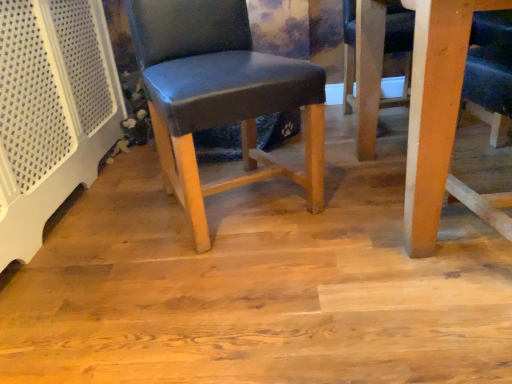
At what (x,y) coordinates should I click in order to perform the action: click on wooden table at lower right. Please return your answer as a coordinate pair (x, y). Looking at the image, I should click on (441, 122).

I want to click on matte blue leather chair at center, so click(220, 96).

Locate an element on the screen. wooden table at lower right is located at coordinates (441, 122).

Which of these two, matte wood floor at center or wooden table at lower right, stands shorter?

With less height is matte wood floor at center.

Locate an element on the screen. table on the right of matte wood floor at center is located at coordinates click(441, 122).

From the image's perspective, between matte wood floor at center and wooden table at lower right, which one is located above?

From the image's view, wooden table at lower right is above.

Considering the relative sizes of matte wood floor at center and wooden table at lower right in the image provided, is matte wood floor at center wider than wooden table at lower right?

Indeed, matte wood floor at center has a greater width compared to wooden table at lower right.

Considering the relative sizes of matte blue leather chair at center and matte wood floor at center in the image provided, is matte blue leather chair at center smaller than matte wood floor at center?

Actually, matte blue leather chair at center might be larger than matte wood floor at center.

Between matte blue leather chair at center and matte wood floor at center, which one appears on the left side from the viewer's perspective?

matte blue leather chair at center.

Is matte blue leather chair at center looking in the opposite direction of matte wood floor at center?

That's not correct — matte blue leather chair at center is not looking away from matte wood floor at center.

Locate an element on the screen. chair located above the matte wood floor at center (from the image's perspective) is located at coordinates (220, 96).

Is wooden table at lower right not within matte blue leather chair at center?

Yes, wooden table at lower right is not within matte blue leather chair at center.

Is wooden table at lower right oriented towards matte blue leather chair at center?

No, wooden table at lower right does not turn towards matte blue leather chair at center.

Which of these two, wooden table at lower right or matte blue leather chair at center, is bigger?

wooden table at lower right is bigger.

Can you confirm if wooden table at lower right is positioned to the left of matte blue leather chair at center?

No.

Can you confirm if wooden table at lower right is shorter than matte wood floor at center?

Incorrect, the height of wooden table at lower right does not fall short of that of matte wood floor at center.

Is point (414, 184) farther from viewer compared to point (435, 339)?

That is True.

Considering the relative sizes of wooden table at lower right and matte wood floor at center in the image provided, is wooden table at lower right wider than matte wood floor at center?

In fact, wooden table at lower right might be narrower than matte wood floor at center.

Is matte wood floor at center located within wooden table at lower right?

No, matte wood floor at center is not surrounded by wooden table at lower right.

Is point (189, 161) in front of point (504, 220)?

No, (189, 161) is further to viewer.

Considering the relative sizes of matte blue leather chair at center and wooden table at lower right in the image provided, is matte blue leather chair at center smaller than wooden table at lower right?

Correct, matte blue leather chair at center occupies less space than wooden table at lower right.

In terms of height, does matte blue leather chair at center look taller or shorter compared to wooden table at lower right?

Clearly, matte blue leather chair at center is taller compared to wooden table at lower right.

In the scene shown: Can wooden table at lower right be found inside matte blue leather chair at center?

Result: No, wooden table at lower right is not inside matte blue leather chair at center.

From their relative heights in the image, would you say matte wood floor at center is taller or shorter than matte blue leather chair at center?

In the image, matte wood floor at center appears to be shorter than matte blue leather chair at center.

Is matte wood floor at center beside matte blue leather chair at center?

No, matte wood floor at center is not with matte blue leather chair at center.

Considering the sizes of objects matte wood floor at center and matte blue leather chair at center in the image provided, who is wider, matte wood floor at center or matte blue leather chair at center?

With larger width is matte wood floor at center.

The image size is (512, 384). I want to click on plywood behind the wooden table at lower right, so click(260, 286).

Locate an element on the screen. This screenshot has width=512, height=384. plywood on the right of matte blue leather chair at center is located at coordinates (260, 286).

When comparing their distances from matte blue leather chair at center, does wooden table at lower right or matte wood floor at center seem closer?

matte wood floor at center is closer to matte blue leather chair at center.

Consider the image. From the image, which object appears to be farther from wooden table at lower right, matte wood floor at center or matte blue leather chair at center?

Among the two, matte blue leather chair at center is located further to wooden table at lower right.

Based on their spatial positions, is matte blue leather chair at center or wooden table at lower right closer to matte wood floor at center?

The object closer to matte wood floor at center is matte blue leather chair at center.

When comparing their distances from wooden table at lower right, does matte blue leather chair at center or matte wood floor at center seem closer?

The object closer to wooden table at lower right is matte wood floor at center.

In the scene shown: Considering their positions, is matte wood floor at center positioned further to matte blue leather chair at center than wooden table at lower right?

wooden table at lower right.

Estimate the real-world distances between objects in this image. Which object is further from matte wood floor at center, wooden table at lower right or matte blue leather chair at center?

wooden table at lower right is positioned further to the anchor matte wood floor at center.

Where is `plywood between matte blue leather chair at center and wooden table at lower right from left to right`? The width and height of the screenshot is (512, 384). plywood between matte blue leather chair at center and wooden table at lower right from left to right is located at coordinates (260, 286).